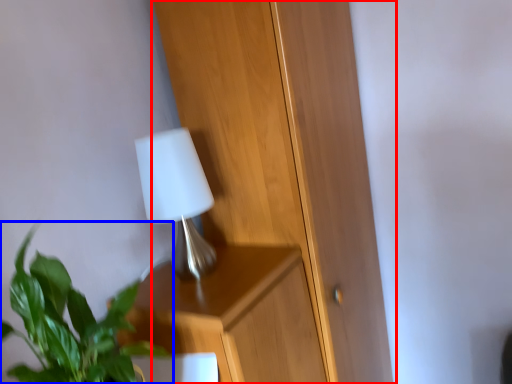
Question: Which point is further to the camera, dresser (highlighted by a red box) or houseplant (highlighted by a blue box)?

Choices:
 (A) dresser
 (B) houseplant

Answer: (A)